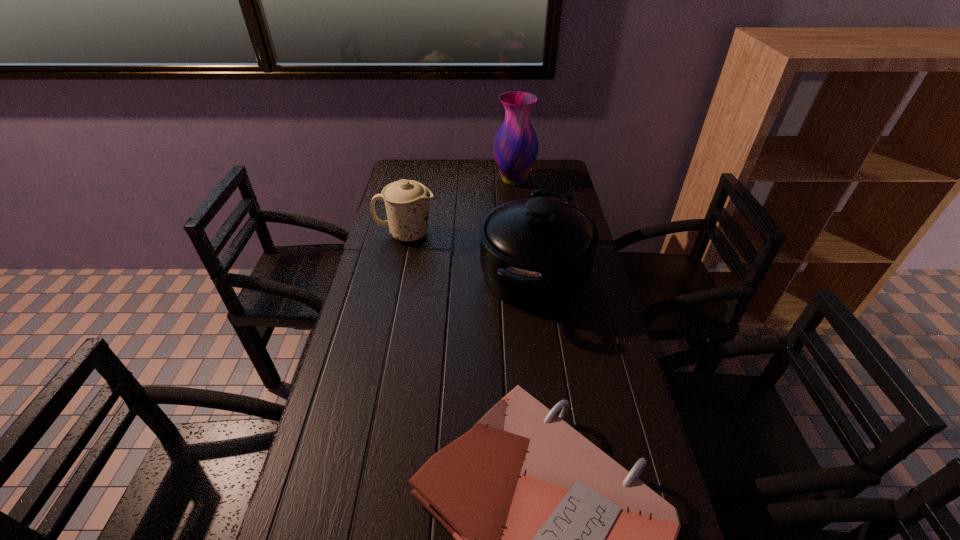
Where is `vase located at the right edge`? The height and width of the screenshot is (540, 960). vase located at the right edge is located at coordinates (515, 147).

Locate an element on the screen. The image size is (960, 540). saucepan at the right edge is located at coordinates (536, 254).

What are the coordinates of `object present at the far right corner` in the screenshot? It's located at (515, 147).

What are the coordinates of `free location at the far edge` in the screenshot? It's located at (466, 178).

Where is `vacant point at the left edge`? The height and width of the screenshot is (540, 960). vacant point at the left edge is located at coordinates tap(364, 307).

You are a GUI agent. You are given a task and a screenshot of the screen. Output one action in this format:
    pyautogui.click(x=<x>, y=<y>)
    Task: Click on the vacant space at the right edge of the desktop
    
    Given the screenshot: What is the action you would take?
    pyautogui.click(x=588, y=375)

In the image, there is a desktop. In order to click on vacant space at the far right corner in this screenshot , I will do `click(564, 174)`.

Where is `vacant area that lies between the leftmost object and the second tallest object`? The image size is (960, 540). vacant area that lies between the leftmost object and the second tallest object is located at coordinates (470, 255).

Choose which object is the nearest neighbor to the nearest object. Please provide its 2D coordinates. Your answer should be formatted as a tuple, i.e. [(x, y)], where the tuple contains the x and y coordinates of a point satisfying the conditions above.

[(536, 254)]

You are a GUI agent. You are given a task and a screenshot of the screen. Output one action in this format:
    pyautogui.click(x=<x>, y=<y>)
    Task: Click on the object that is the closest to the second tallest object
    
    Given the screenshot: What is the action you would take?
    pyautogui.click(x=407, y=201)